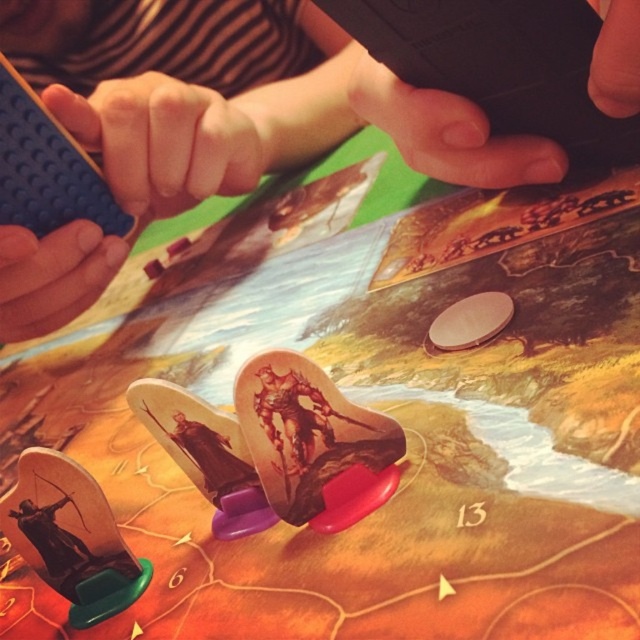
Question: Is blue plastic lego brick at upper left further to the viewer compared to black matte phone at upper center?

Choices:
 (A) yes
 (B) no

Answer: (A)

Question: Is blue plastic lego brick at upper left positioned at the back of black matte phone at upper center?

Choices:
 (A) yes
 (B) no

Answer: (A)

Question: Is the position of blue plastic lego brick at upper left more distant than that of black matte phone at upper center?

Choices:
 (A) no
 (B) yes

Answer: (B)

Question: Which point is closer to the camera taking this photo?

Choices:
 (A) (442, 44)
 (B) (337, 74)

Answer: (A)

Question: Which point appears farthest from the camera in this image?

Choices:
 (A) (305, 44)
 (B) (436, 42)

Answer: (A)

Question: Which of the following is the closest to the observer?

Choices:
 (A) (266, 8)
 (B) (378, 20)

Answer: (B)